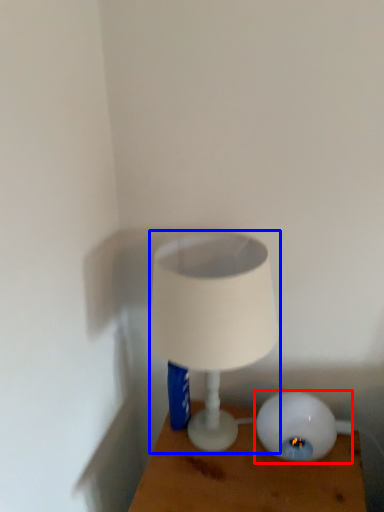
Question: Among these objects, which one is nearest to the camera, lamp (highlighted by a red box) or lamp (highlighted by a blue box)?

Choices:
 (A) lamp
 (B) lamp

Answer: (B)